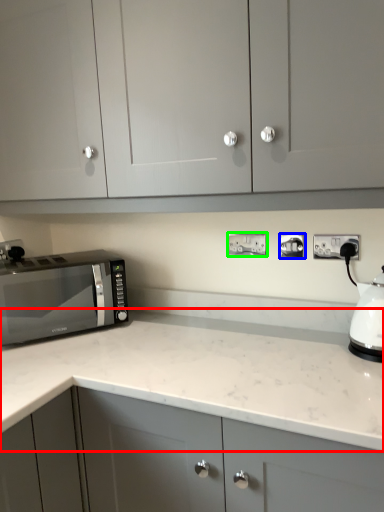
Question: Which object is the closest to the countertop (highlighted by a red box)? Choose among these: electric outlet (highlighted by a blue box) or electric outlet (highlighted by a green box).

Choices:
 (A) electric outlet
 (B) electric outlet

Answer: (B)